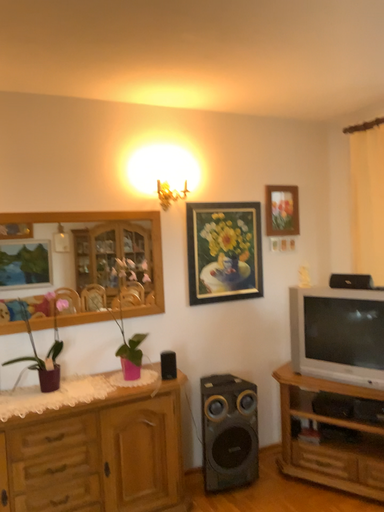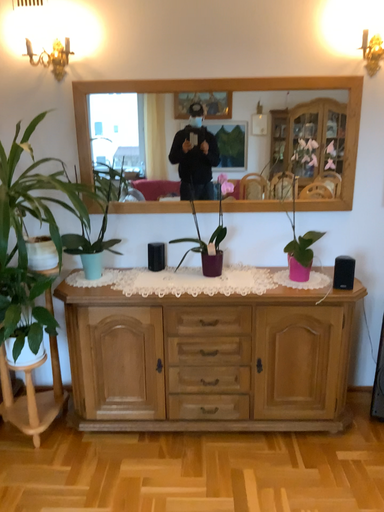
Question: How did the camera likely rotate when shooting the video?

Choices:
 (A) rotated right
 (B) rotated left

Answer: (B)